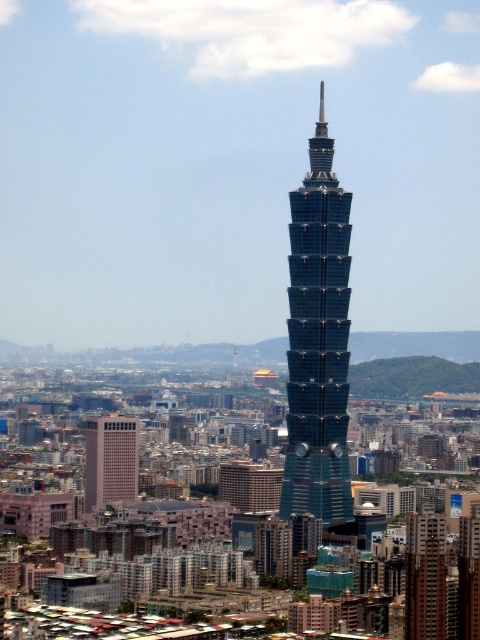
You are standing at the point closest to the viewer in the image. Which point, point (444, 584) or point (135, 428), is farther away from you?

Point (444, 584) is farther away from you because it is behind point (135, 428).

You are standing in front of the Taipei 101 skyscraper and see two points marked in the image. The first point is at coordinates point (331, 269) and the second is at point (96, 481). Which of these two points is nearer to you?

Point (331, 269) is closer to the viewer than point (96, 481).

You are standing at the observation deck of the shiny glass skyscraper at center. Your friend is at the base of the building, 1000 feet away from the camera. Can they see you through the reflective surface of the skyscraper?

The shiny glass skyscraper at center and camera are 2114.36 feet apart, which is farther than the 1000 feet distance between your friend and the camera. Since the friend is closer to the camera than the building, they might be able to see the reflection depending on the angle and clarity of the glass, but the exact visibility isn not specified in the description.